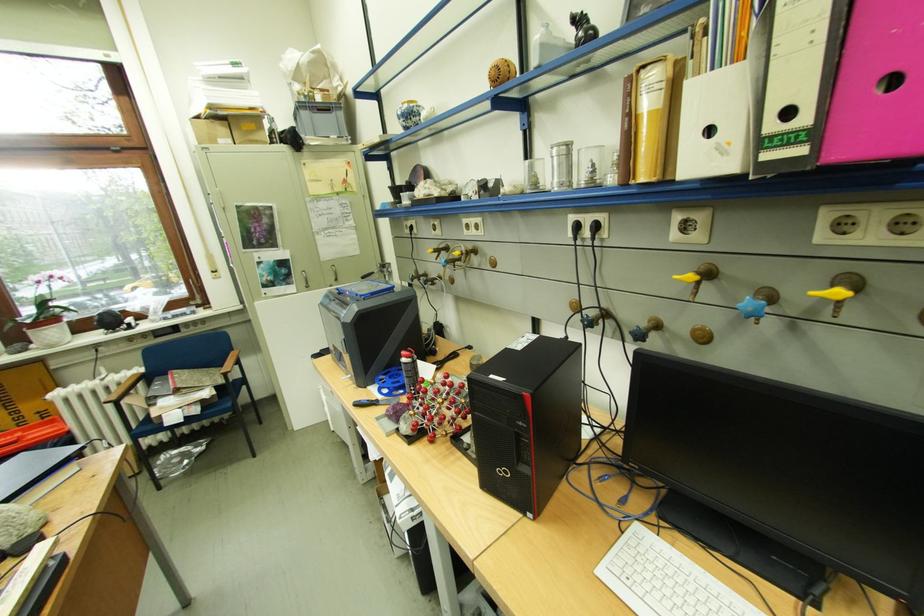
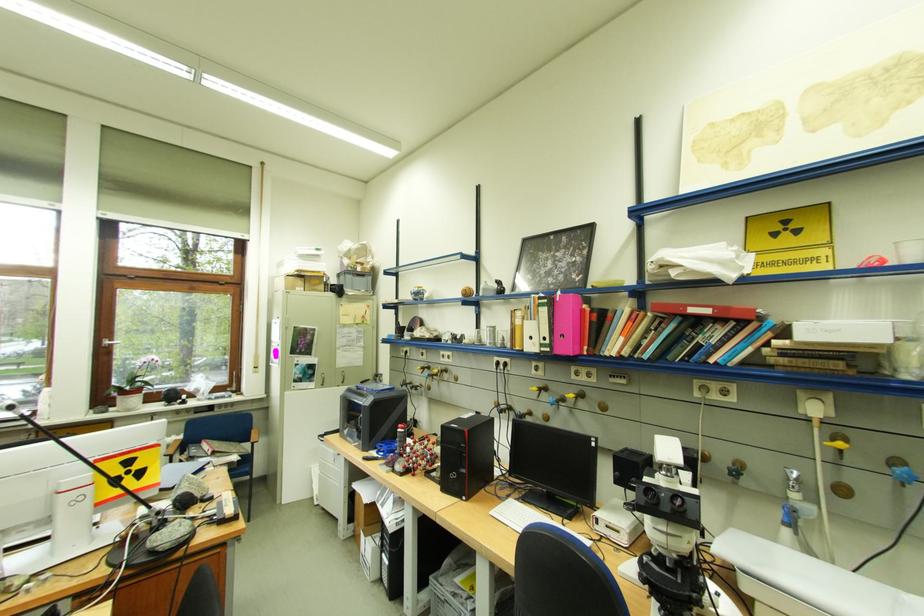
Where in the second image is the point corresponding to point (569, 156) from the first image?

(500, 331)